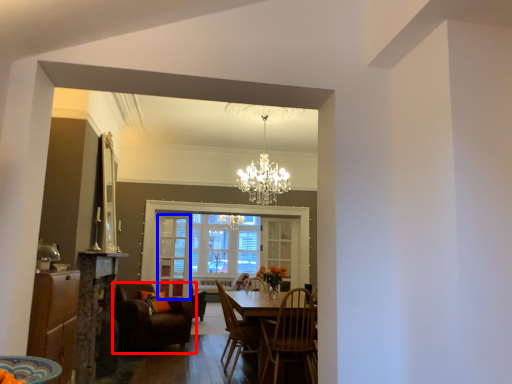
Question: Which point is further to the camera, chair (highlighted by a red box) or glass door (highlighted by a blue box)?

Choices:
 (A) chair
 (B) glass door

Answer: (B)